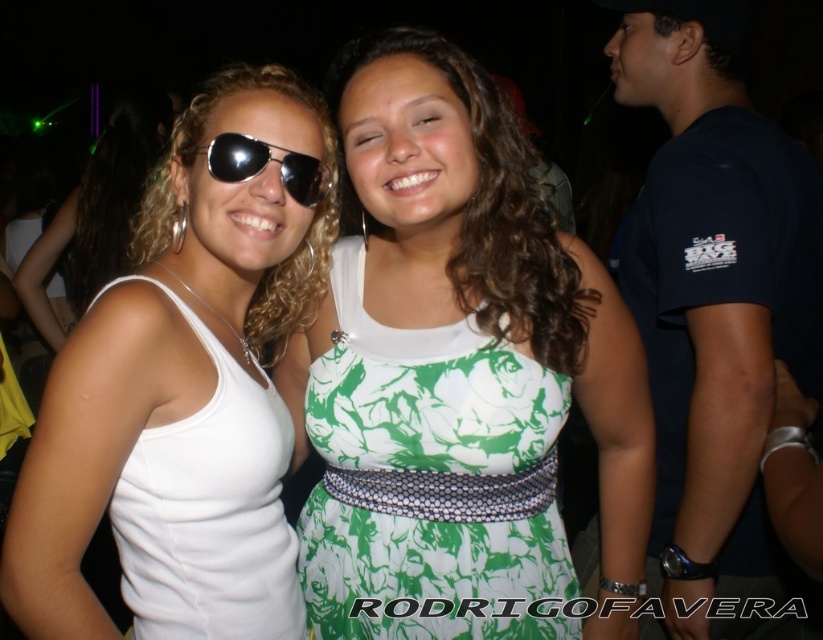
Which is above, green floral fabric dress at center or shiny black aviator sunglasses at center?

shiny black aviator sunglasses at center is higher up.

Is point (551, 413) closer to viewer compared to point (301, 160)?

Yes, it is in front of point (301, 160).

I want to click on green floral fabric dress at center, so pyautogui.click(x=431, y=481).

Can you confirm if white matte tank top at center is wider than white fabric dress at left?

Yes.

Can you confirm if white matte tank top at center is bigger than white fabric dress at left?

Correct, white matte tank top at center is larger in size than white fabric dress at left.

What are the coordinates of `white matte tank top at center` in the screenshot? It's located at (168, 332).

The height and width of the screenshot is (640, 823). What are the coordinates of `white matte tank top at center` in the screenshot? It's located at (168, 332).

Can you confirm if green printed dress at center is taller than shiny black aviator sunglasses at center?

Yes.

Between green printed dress at center and shiny black aviator sunglasses at center, which one has less height?

With less height is shiny black aviator sunglasses at center.

Is point (500, 106) positioned behind point (296, 163)?

Yes, point (500, 106) is farther from viewer.

Identify the location of green printed dress at center. The image size is (823, 640). (486, 209).